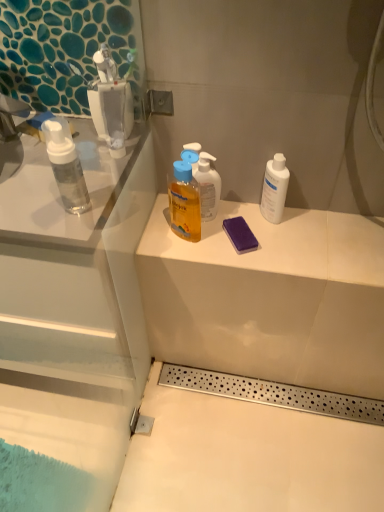
This screenshot has width=384, height=512. In order to click on free area in between translucent yellow liquid at upper center and purple sponge at center in this screenshot , I will do `click(213, 239)`.